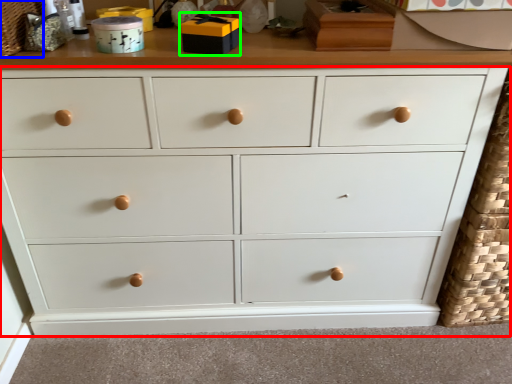
Question: Estimate the real-world distances between objects in this image. Which object is closer to chest of drawers (highlighted by a red box), basket (highlighted by a blue box) or toy (highlighted by a green box)?

Choices:
 (A) basket
 (B) toy

Answer: (B)